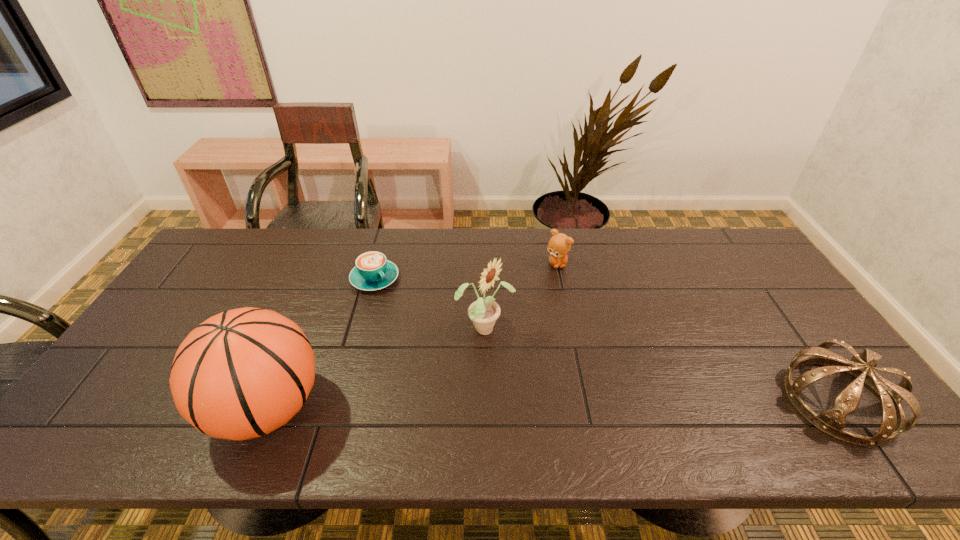
Locate which object ranks fourth in proximity to the basketball. Please provide its 2D coordinates. Your answer should be formatted as a tuple, i.e. [(x, y)], where the tuple contains the x and y coordinates of a point satisfying the conditions above.

[(832, 421)]

Where is `vacant region that satisfies the following two spatial constraints: 1. on the back side of the third object from left to right; 2. on the right side of the basketball`? vacant region that satisfies the following two spatial constraints: 1. on the back side of the third object from left to right; 2. on the right side of the basketball is located at coordinates (300, 329).

Image resolution: width=960 pixels, height=540 pixels. I want to click on vacant area that satisfies the following two spatial constraints: 1. on the back side of the basketball; 2. on the left side of the teddy bear, so click(326, 264).